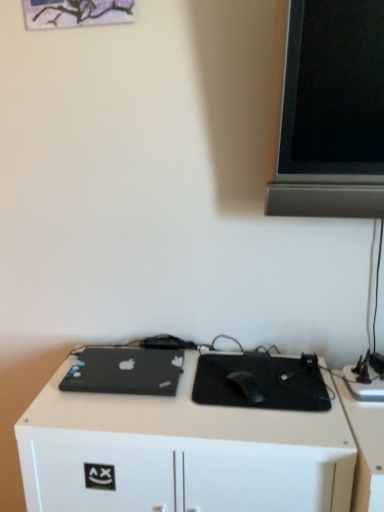
Question: Relative to black matte laptop at lower left, is white matte desk at center in front or behind?

Choices:
 (A) behind
 (B) front

Answer: (B)

Question: Looking at the image, does white matte desk at center seem bigger or smaller compared to black matte laptop at lower left?

Choices:
 (A) small
 (B) big

Answer: (B)

Question: Which is nearer to the black matte laptop at lower left?

Choices:
 (A) black matte mousepad at center
 (B) black matte mouse at center
 (C) white matte desk at center

Answer: (C)

Question: Which object is the farthest from the black matte mousepad at center?

Choices:
 (A) black matte laptop at lower left
 (B) white matte desk at center
 (C) black matte mouse at center

Answer: (A)